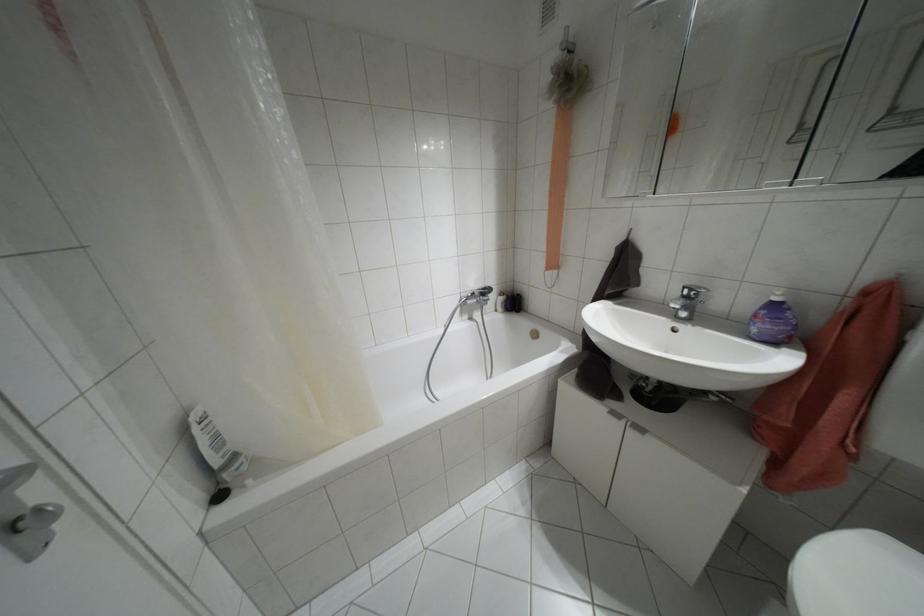
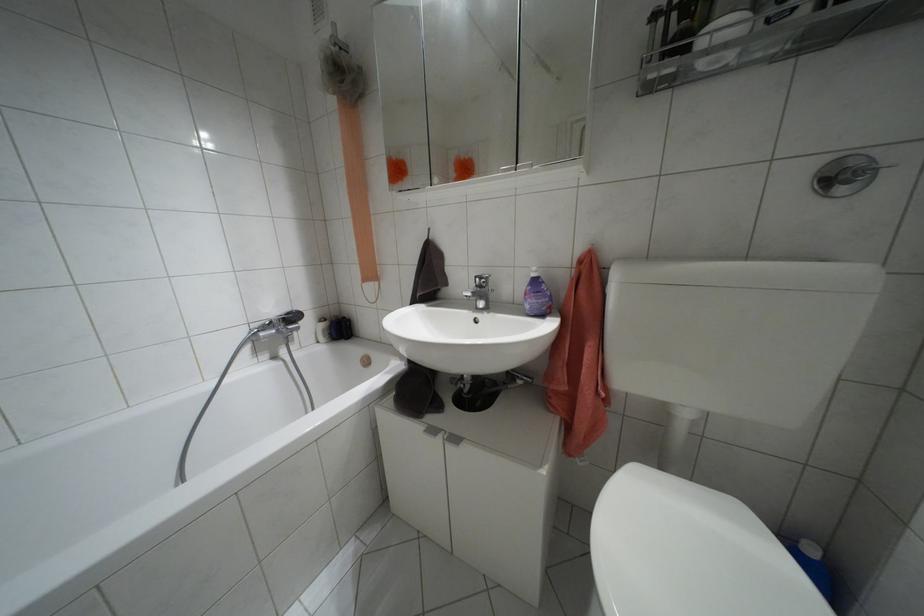
Question: The camera is either moving clockwise (left) or counter-clockwise (right) around the object. The first image is from the beginning of the video and the second image is from the end. Is the camera moving left or right when shooting the video?

Choices:
 (A) Left
 (B) Right

Answer: (A)